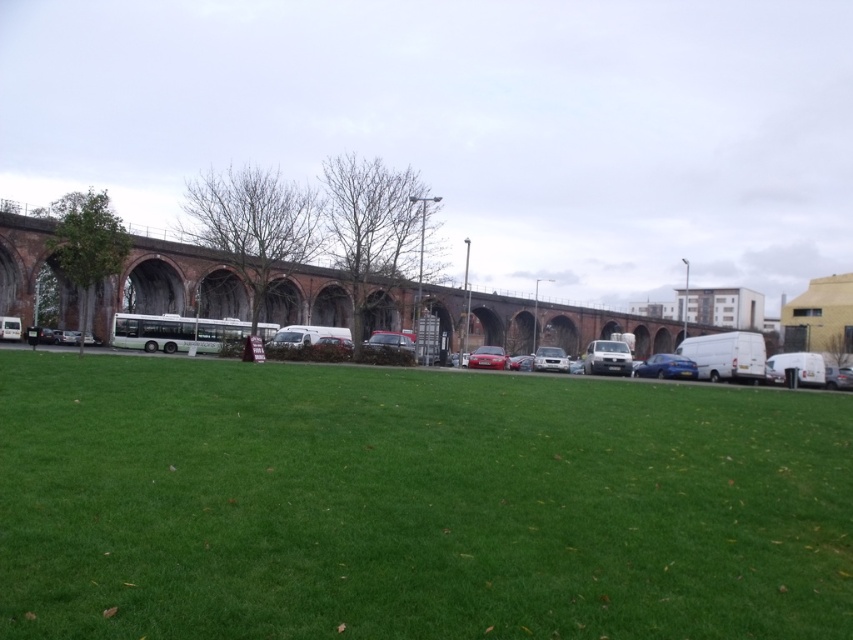
Question: Which object appears farthest from the camera in this image?

Choices:
 (A) glossy red car at center
 (B) green grass at lower center
 (C) glossy blue car at center
 (D) brick at center

Answer: (C)

Question: Which point is closer to the camera taking this photo?

Choices:
 (A) (463, 493)
 (B) (535, 353)
 (C) (505, 358)

Answer: (A)

Question: Which of the following is the closest to the observer?

Choices:
 (A) 173,336
 (B) 846,438
 (C) 628,371

Answer: (B)

Question: Can you confirm if white matte bus at center is smaller than glossy red car at center?

Choices:
 (A) yes
 (B) no

Answer: (B)

Question: Does glossy blue car at center come behind glossy red car at center?

Choices:
 (A) yes
 (B) no

Answer: (A)

Question: Is green grass at lower center to the right of white glossy van at center from the viewer's perspective?

Choices:
 (A) no
 (B) yes

Answer: (A)